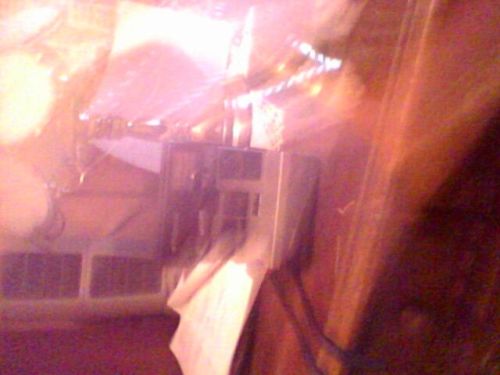
Where is `silver frames of vents`? This screenshot has height=375, width=500. silver frames of vents is located at coordinates (106, 304), (64, 303).